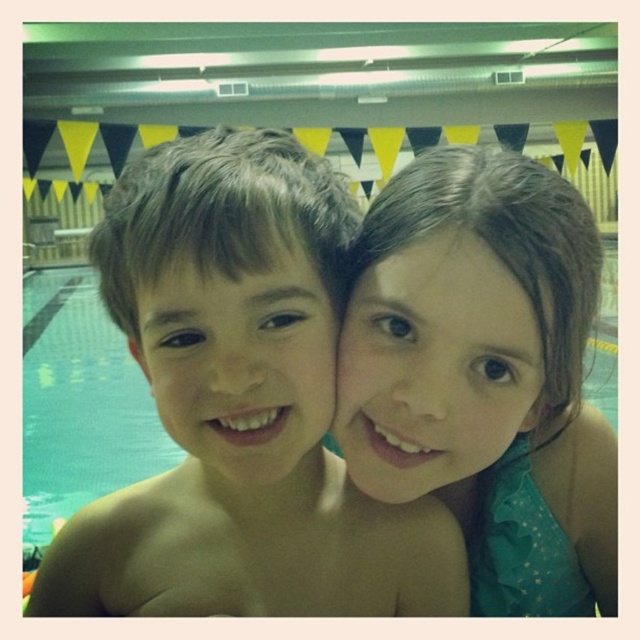
In the scene shown: You are taking a photo of the two children in the swimming pool area. You want to focus on the point closer to the camera. Which point should you choose between point (120, 294) and point (509, 317)?

Point (120, 294) is closer to the camera than point (509, 317), so you should choose point (120, 294) to focus on.